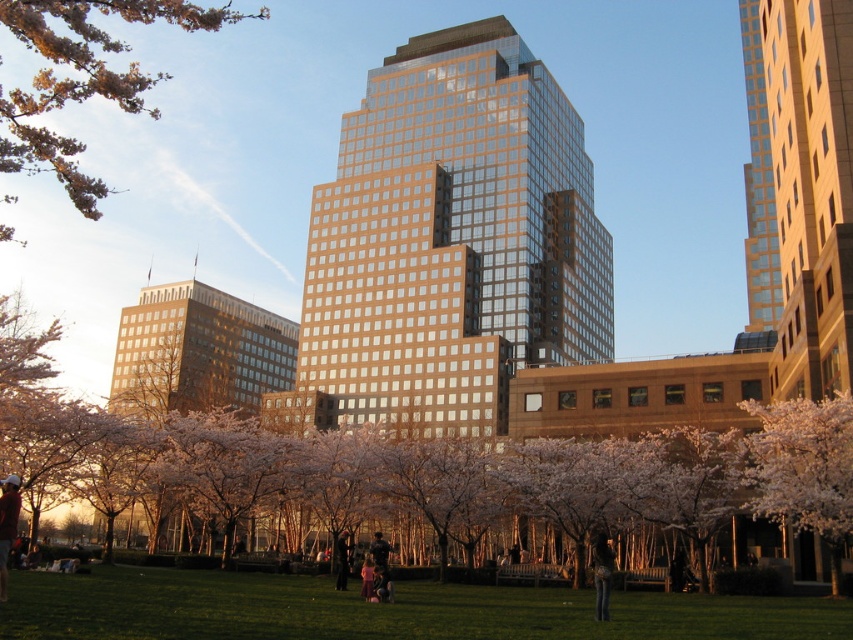
Looking at this image, you are standing at the center of the park and want to find the green grass at lower center. Based on the coordinates given, in which direction should you move to reach it?

The green grass at lower center is located at coordinates point (381, 609). Since the lower center position is typically below the central point, you should move downward from the center to reach it.

You are standing in the park and want to take a photo of the tall glass building in the background without any cherry blossom trees blocking the view. The park has cherry blossom trees evenly spaced along the path leading to the building. If you position yourself at point (811, 428), will the cherry blossom trees block your view of the building?

The distance between point (811, 428) and the viewer is 38.75 meters. Since the cherry blossom trees are evenly spaced along the path, positioning yourself at this point may still result in some trees blocking the view depending on their spacing and height. However, the exact obstruction cannot be determined without additional information about the tree spacing and height relative to the distance.

You are a photographer trying to capture the entire scene of the green grass at lower center and the dark brown leather jacket at lower left in one shot. Given that your camera can only focus on objects within a 100cm width, will both objects fit in the frame?

The green grass at lower center is bigger than the dark brown leather jacket at lower left, but since the camera can focus on objects within a 100cm width, both objects can fit in the frame as long as their combined size does not exceed the 100cm limit. However, the exact dimensions are not provided, so this depends on their actual sizes.